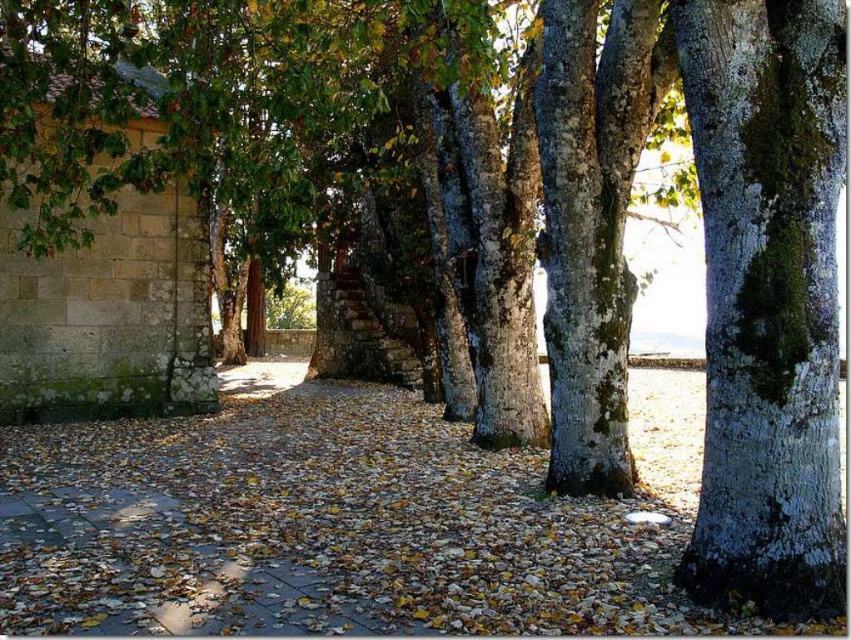
Which is in front, point (518, 472) or point (749, 90)?

Positioned in front is point (749, 90).

Between brown stone pavement at center and green mossy bark tree at right, which one is positioned higher?

green mossy bark tree at right is above.

Is point (214, 472) farther from viewer compared to point (757, 83)?

Yes, it is.

Where is `brown stone pavement at center`? brown stone pavement at center is located at coordinates (340, 524).